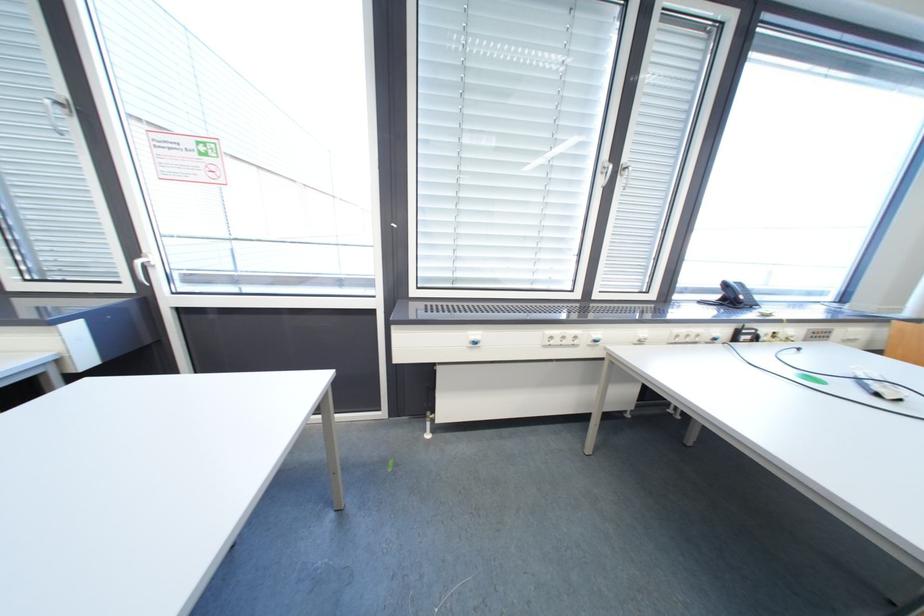
Where would you lift the silver remote control? Please return your answer as a coordinate pair (x, y).

(878, 386)